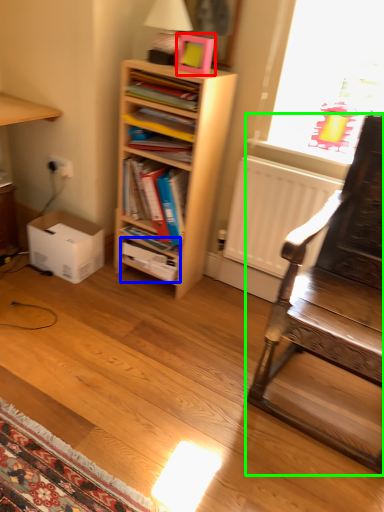
Question: Based on their relative distances, which object is nearer to picture frame (highlighted by a red box)? Choose from book (highlighted by a blue box) and chair (highlighted by a green box).

Choices:
 (A) book
 (B) chair

Answer: (A)